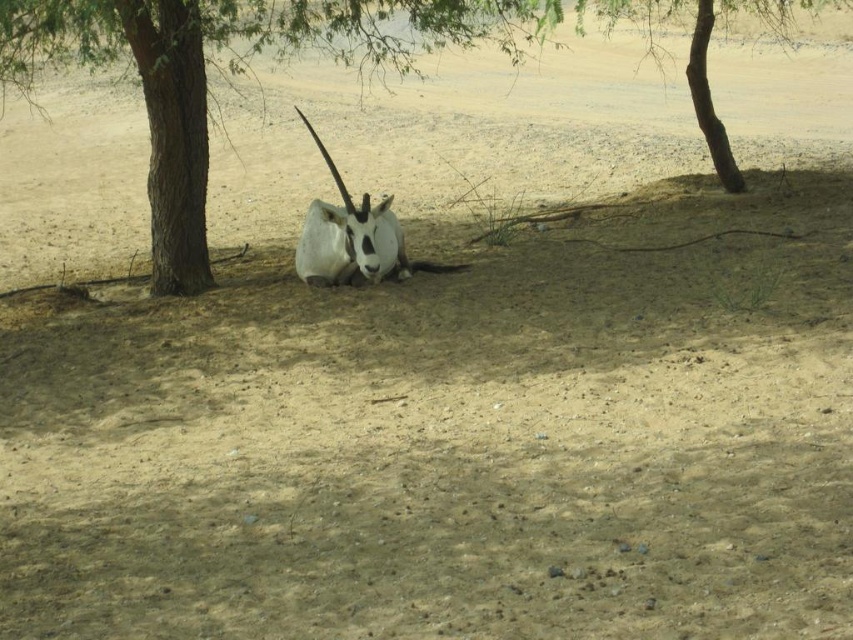
You are a hiker in the desert and want to find shade. You see the brown rough tree at left and the brown rough tree at upper center. Which tree would provide more shade coverage based on their positions?

The brown rough tree at upper center provides more shade coverage because the brown rough tree at left is positioned under it, meaning it is closer to the ground and likely casts a smaller shadow.

You are a photographer trying to capture the white matte antelope at center and the brown rough tree at upper center in a single frame. Based on their sizes, which one should you focus on first to ensure both are in the frame?

The brown rough tree at upper center is taller than the white matte antelope at center, so you should focus on the brown rough tree at upper center first to ensure both are in the frame.

You are standing in the desert scene and want to walk from the point closer to you to the point farther away. Which path should you take between the two points, point 1 at point (767, 13) and point 2 at point (386, 221)?

The point closer to you is point 2 at point (386, 221), and the farther point is point 1 at point (767, 13). Therefore, you should walk from point 2 to point 1 to go from the closer to the farther point.